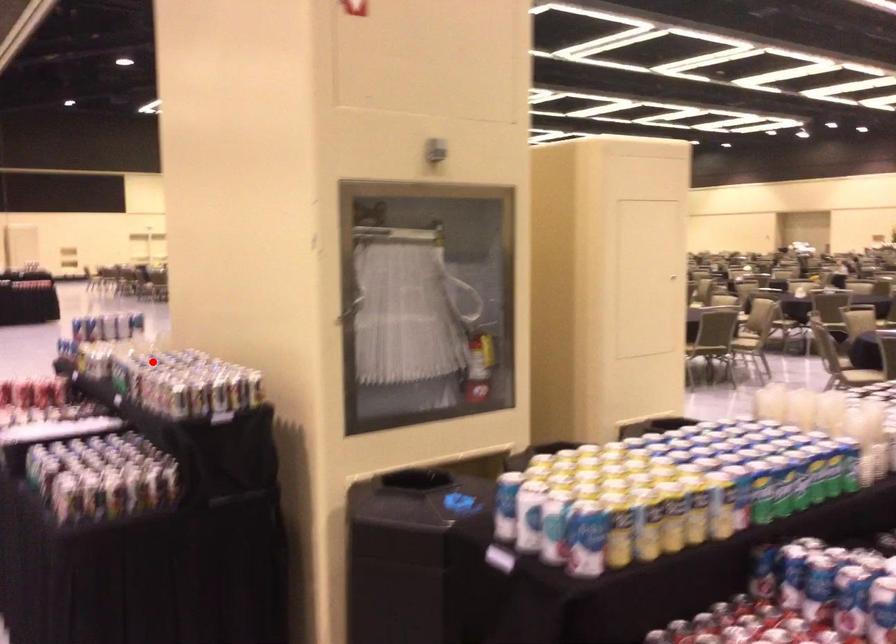
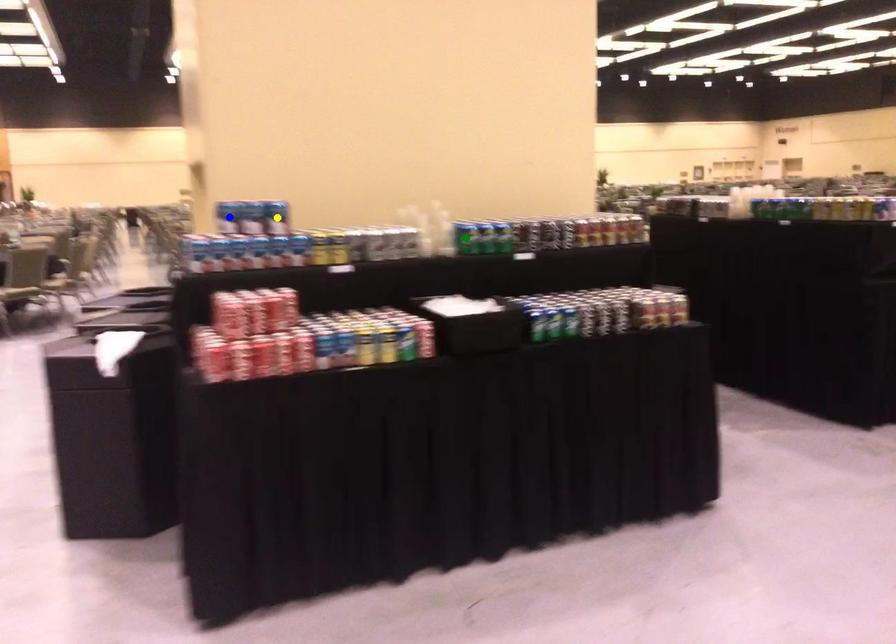
Question: I am providing you with two images of the same scene from different viewpoints. A red point is marked on the first image. You are given multiple points on the second image. Which mark in image 2 goes with the point in image 1?

Choices:
 (A) green point
 (B) blue point
 (C) yellow point

Answer: (A)